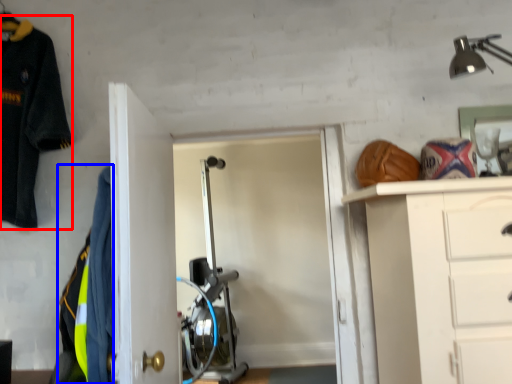
Question: Among these objects, which one is nearest to the camera, uniform (highlighted by a red box) or uniform (highlighted by a blue box)?

Choices:
 (A) uniform
 (B) uniform

Answer: (B)